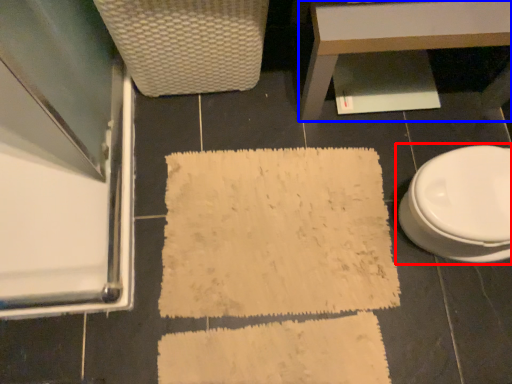
Question: Which object is further to the camera taking this photo, toilet (highlighted by a red box) or table (highlighted by a blue box)?

Choices:
 (A) toilet
 (B) table

Answer: (B)